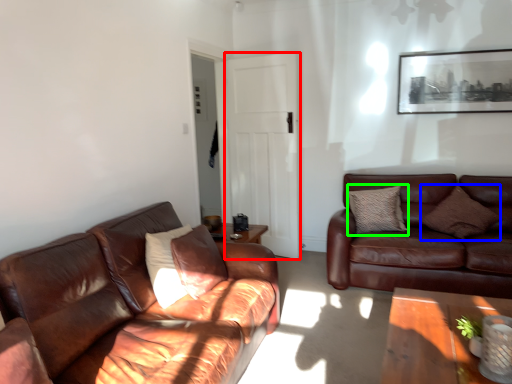
Question: Which object is the farthest from glass door (highlighted by a red box)? Choose among these: pillow (highlighted by a blue box) or pillow (highlighted by a green box).

Choices:
 (A) pillow
 (B) pillow

Answer: (A)